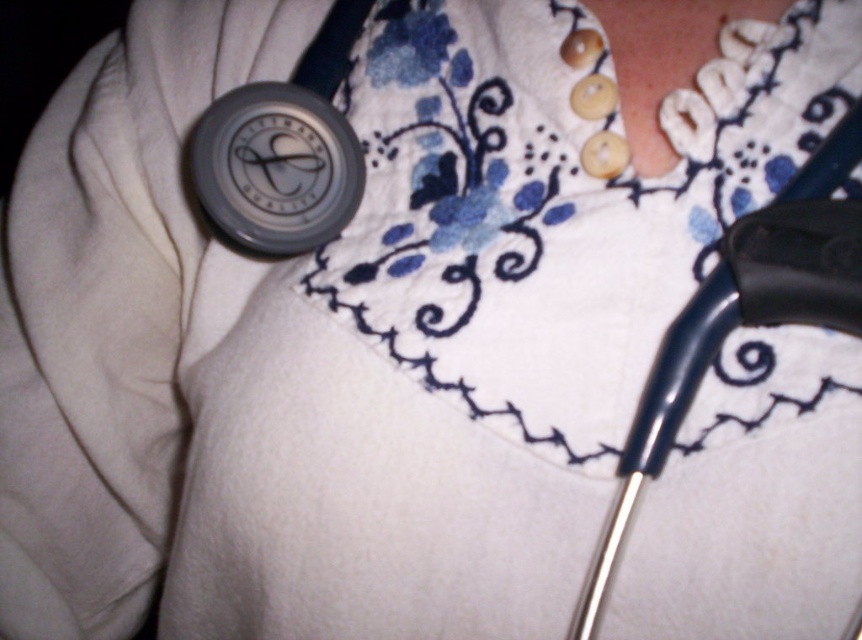
Between point (330, 131) and point (742, 1), which one is positioned in front?

Positioned in front is point (742, 1).

Can you confirm if matte gray stethoscope at center is positioned above pearl-like buttons at upper right?

No.

Is point (264, 136) closer to camera compared to point (632, 22)?

Yes, point (264, 136) is closer to viewer.

Locate an element on the screen. matte gray stethoscope at center is located at coordinates (275, 168).

Between point (834, 214) and point (216, 202), which one is positioned in front?

Point (834, 214) is in front.

Which is above, metallic blue stethoscope at right or matte gray stethoscope at center?

matte gray stethoscope at center is higher up.

Describe the element at coordinates (745, 316) in the screenshot. This screenshot has height=640, width=862. I see `metallic blue stethoscope at right` at that location.

The width and height of the screenshot is (862, 640). In order to click on metallic blue stethoscope at right in this screenshot , I will do `click(745, 316)`.

Who is more forward, (753,298) or (642,49)?

Positioned in front is point (753,298).

Can you confirm if metallic blue stethoscope at right is taller than pearl-like buttons at upper right?

Yes.

Identify the location of metallic blue stethoscope at right. pyautogui.click(x=745, y=316).